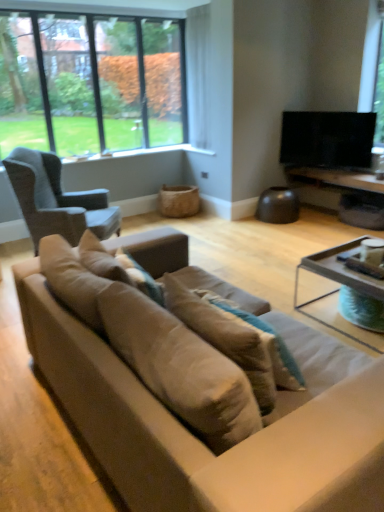
Question: Is dark gray fabric chair at left taller or shorter than clear glass window at upper left?

Choices:
 (A) short
 (B) tall

Answer: (A)

Question: Visually, is dark gray fabric chair at left positioned to the left or to the right of clear glass window at upper left?

Choices:
 (A) right
 (B) left

Answer: (B)

Question: Estimate the real-world distances between objects in this image. Which object is farther from the dark gray fabric chair at left?

Choices:
 (A) suede couch at center
 (B) translucent glass coffee table at right
 (C) black glossy tv at upper right
 (D) transparent glass window screen at upper right
 (E) clear glass window at upper left

Answer: (D)

Question: Which of these objects is positioned farthest from the suede couch at center?

Choices:
 (A) clear glass window at upper left
 (B) dark gray fabric chair at left
 (C) translucent glass coffee table at right
 (D) wooden tray at lower right
 (E) suede-like beige pillow at center, acting as the 1th pillow starting from the left

Answer: (A)